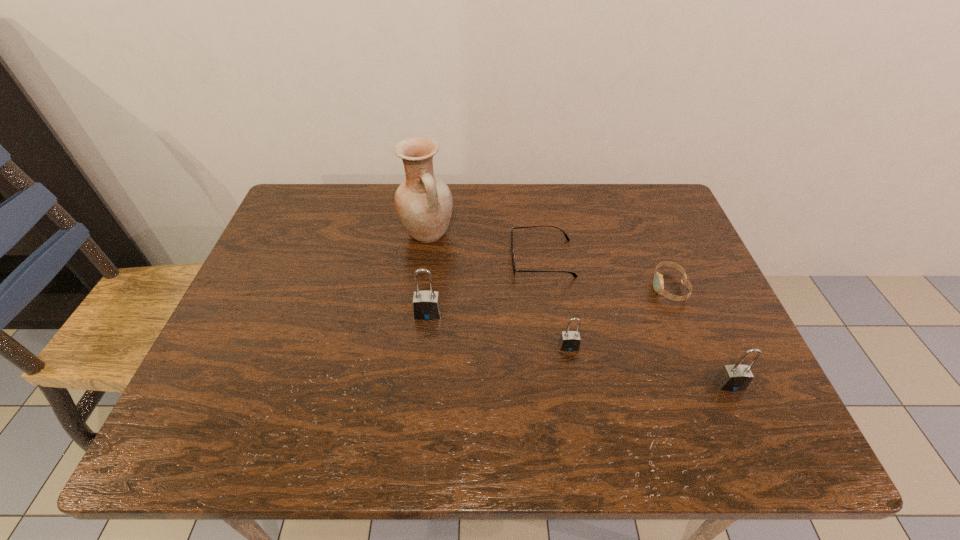
Please point a free position for a padlock on the left. Please provide its 2D coordinates. Your answer should be formatted as a tuple, i.e. [(x, y)], where the tuple contains the x and y coordinates of a point satisfying the conditions above.

[(303, 285)]